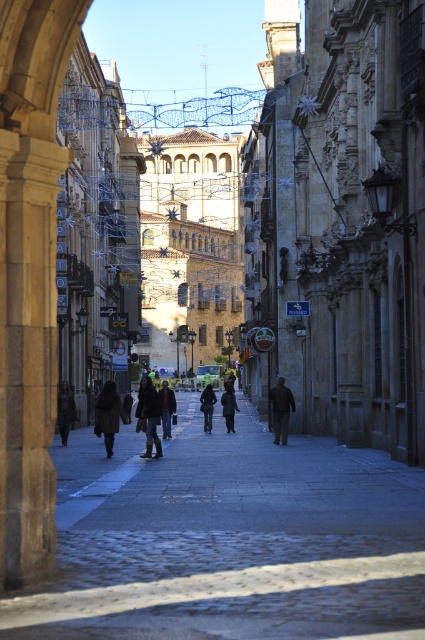
Is dark brown coat at center thinner than dark gray coat at center?

Yes, dark brown coat at center is thinner than dark gray coat at center.

Between dark brown coat at center and dark gray coat at center, which one is positioned lower?

dark gray coat at center

The width and height of the screenshot is (425, 640). I want to click on dark brown coat at center, so click(280, 408).

What are the coordinates of `dark brown coat at center` in the screenshot? It's located at (280, 408).

Which is more to the left, dark gray jeans at center or dark brown leather jacket at center?

dark brown leather jacket at center

Locate an element on the screen. dark gray jeans at center is located at coordinates (149, 413).

This screenshot has width=425, height=640. What are the coordinates of `dark gray jeans at center` in the screenshot? It's located at (149, 413).

Does point (305, 484) lie in front of point (118, 420)?

Yes.

At what (x,y) coordinates should I click in order to perform the action: click on cobblestone pavement at center. Please return your answer as a coordinate pair (x, y). The image size is (425, 640). Looking at the image, I should click on (229, 540).

Between point (414, 602) and point (110, 390), which one is positioned behind?

Positioned behind is point (110, 390).

Identify the location of cobblestone pavement at center. The width and height of the screenshot is (425, 640). (229, 540).